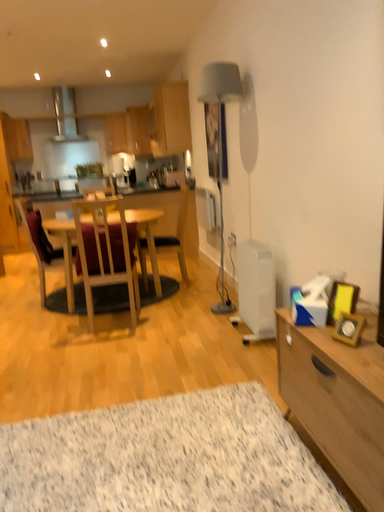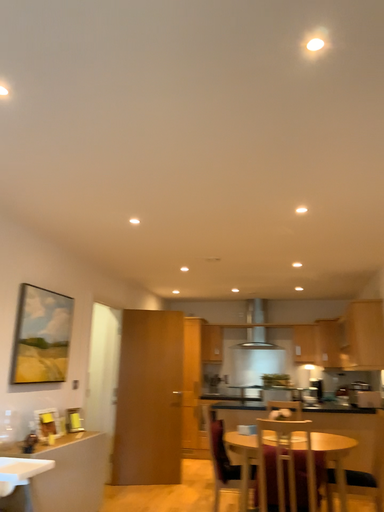
Question: Which way did the camera rotate in the video?

Choices:
 (A) rotated right
 (B) rotated left

Answer: (B)